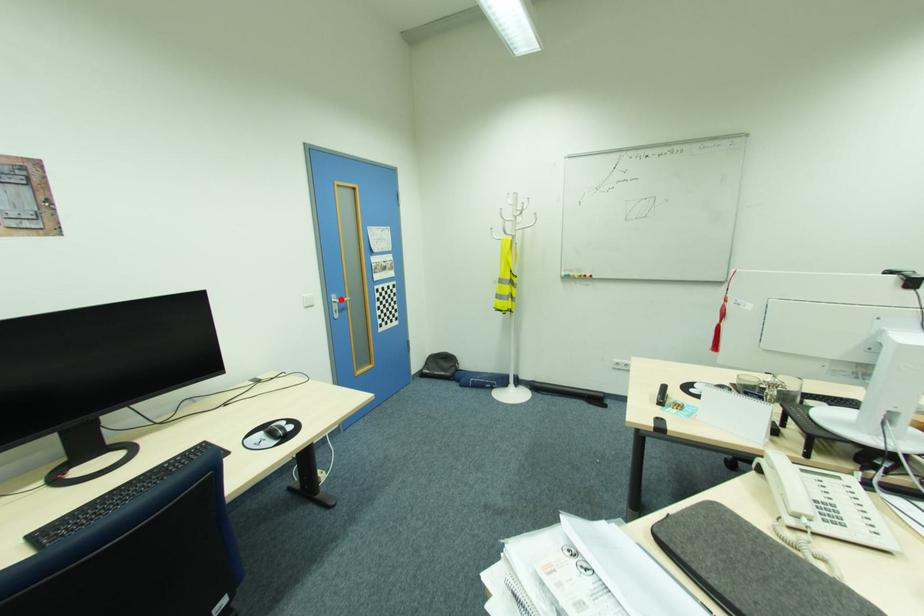
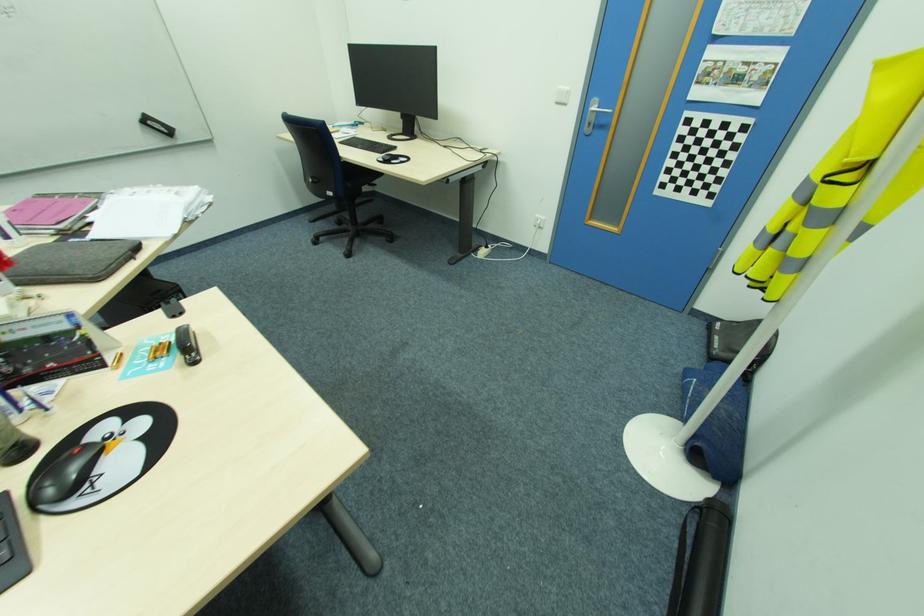
Question: I am providing you with two images of the same scene from different viewpoints. A red point is marked on the first image. Can you still see the location of the red point in image 2?

Choices:
 (A) Yes
 (B) No

Answer: (A)